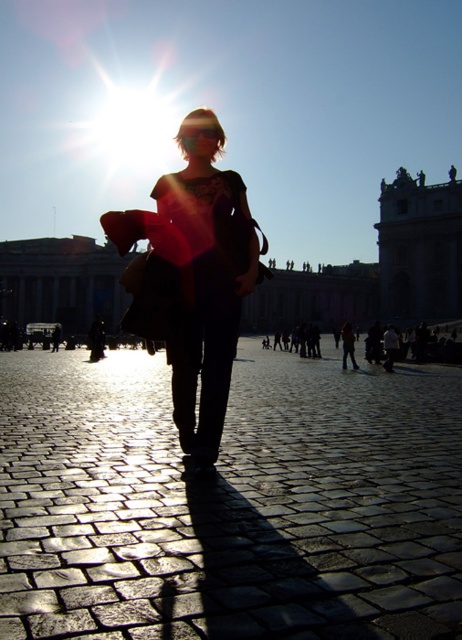
You are a photographer trying to capture the matte black coat at center and the orange fabric bag at center in a single shot. Since the lens flare is obstructing the view, you decide to adjust your position to ensure both objects are visible. Which object should you prioritize focusing on first to maintain clarity in your photo?

The matte black coat at center is closer to the viewer than the orange fabric bag at center, so you should focus on the matte black coat at center first to ensure it remains sharp and clear in the photograph.

You are standing in the square and want to take a photo of the point at coordinates point (42, 284). Your camera has a maximum focus range of 100 meters. Will the camera be able to focus on the point?

The distance of point (42, 284) from camera is 102.88 meters, which exceeds the camera maximum focus range of 100 meters. The camera cannot focus on the point.